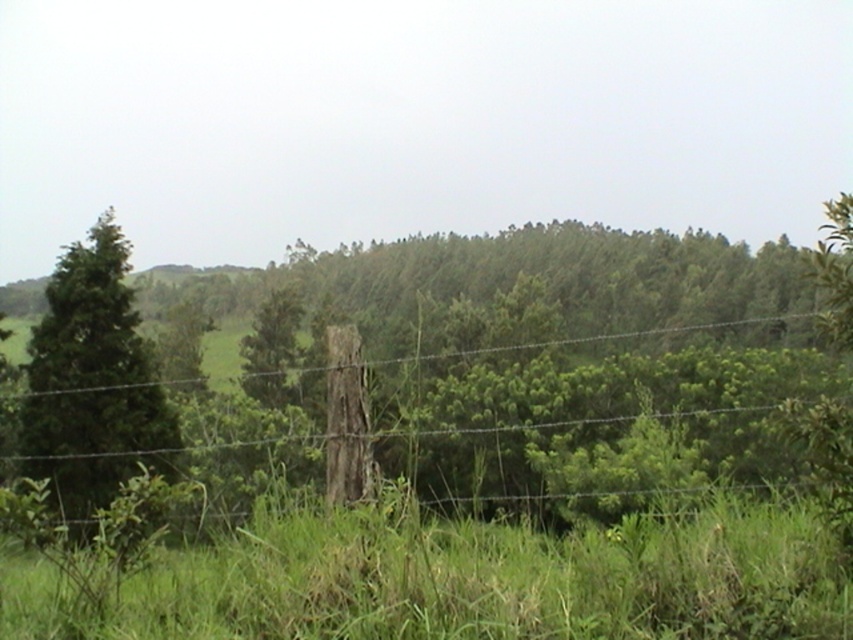
Question: From the image, what is the correct spatial relationship of green matte tree at left in relation to green matte tree at center?

Choices:
 (A) left
 (B) right

Answer: (B)

Question: Among these points, which one is nearest to the camera?

Choices:
 (A) (129, 333)
 (B) (289, 353)

Answer: (A)

Question: Is green matte tree at left bigger than green matte tree at center?

Choices:
 (A) no
 (B) yes

Answer: (B)

Question: Which of the following is the closest to the observer?

Choices:
 (A) wire mesh at center
 (B) green matte tree at left

Answer: (A)

Question: Is wire mesh at center to the right of green matte tree at left from the viewer's perspective?

Choices:
 (A) yes
 (B) no

Answer: (A)

Question: Among these points, which one is farthest from the camera?

Choices:
 (A) (128, 353)
 (B) (252, 324)
 (C) (508, 496)

Answer: (B)